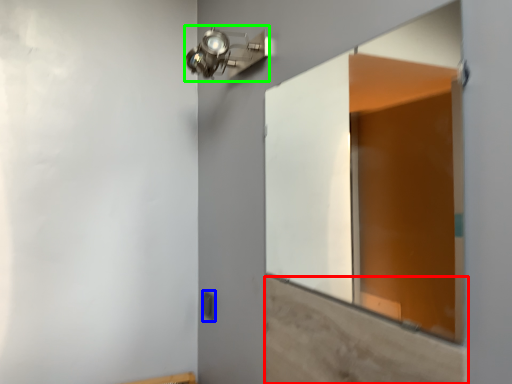
Question: Based on their relative distances, which object is farther from plywood (highlighted by a red box)? Choose from light switch (highlighted by a blue box) and light fixture (highlighted by a green box).

Choices:
 (A) light switch
 (B) light fixture

Answer: (A)